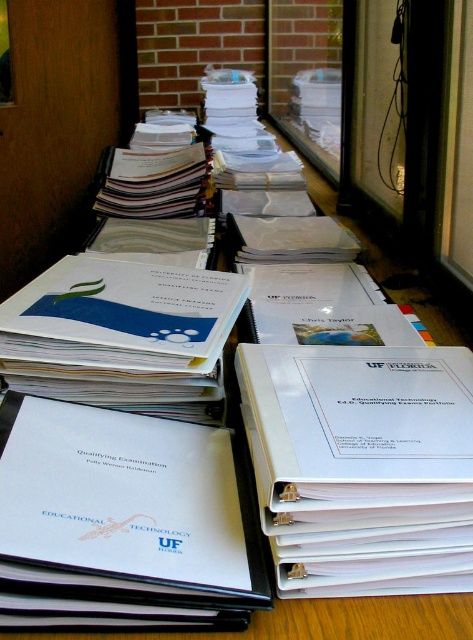
You are organizing the desk and need to place a new folder that is 4 inches wide between the white matte binder at center and the white plastic binder at center. Is there enough space between them to fit the new folder?

The white matte binder at center is 5.00 inches from the white plastic binder at center. Since the new folder is 4 inches wide, there is enough space between them to fit the new folder.

You are an office worker who needs to locate the white matte binder at center on your desk. Based on the coordinates provided, where should you look?

The white matte binder at center is located at point coordinates (122, 522).

You are organizing a presentation and need to place the white matte binder at center and the white plastic binder at center on a shelf. Which binder should you place first to ensure they both fit on the shelf?

The white matte binder at center is smaller than the white plastic binder at center, so you should place the white plastic binder at center first to accommodate its larger size before placing the smaller one.